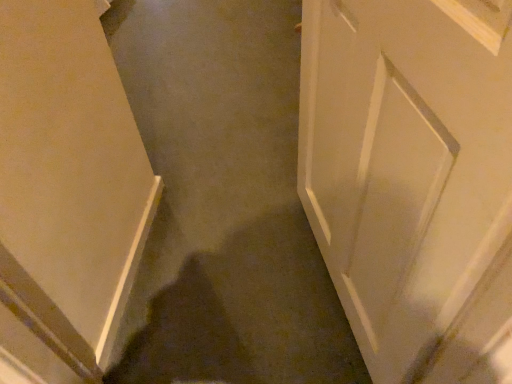
Locate an element on the screen. white matte door at center is located at coordinates (413, 180).

What do you see at coordinates (413, 180) in the screenshot?
I see `white matte door at center` at bounding box center [413, 180].

The height and width of the screenshot is (384, 512). Identify the location of white matte door at center. [x=413, y=180].